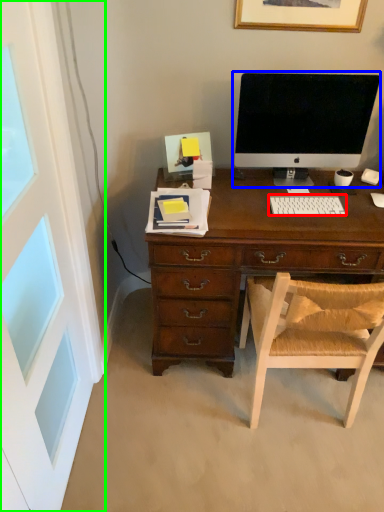
Question: Estimate the real-world distances between objects in this image. Which object is closer to computer keyboard (highlighted by a red box), computer monitor (highlighted by a blue box) or screen door (highlighted by a green box)?

Choices:
 (A) computer monitor
 (B) screen door

Answer: (A)